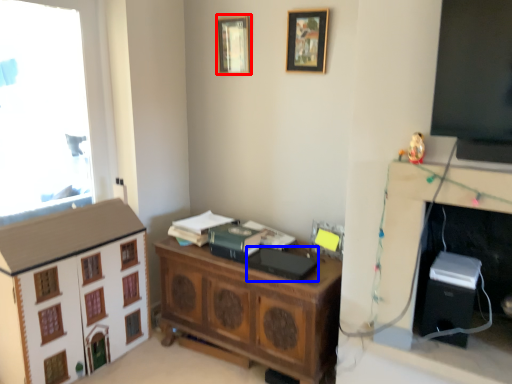
Question: Which object is closer to the camera taking this photo, picture frame (highlighted by a red box) or book (highlighted by a blue box)?

Choices:
 (A) picture frame
 (B) book

Answer: (B)